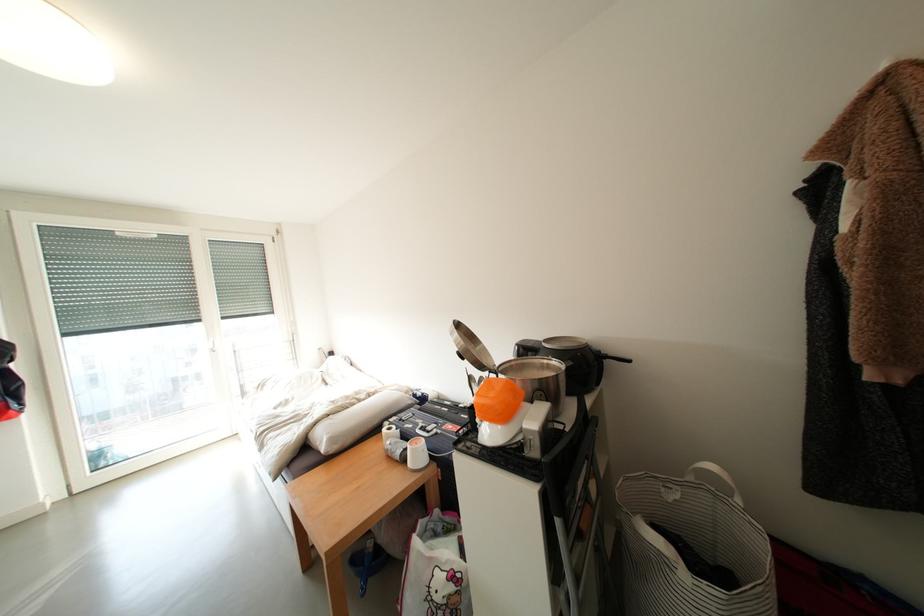
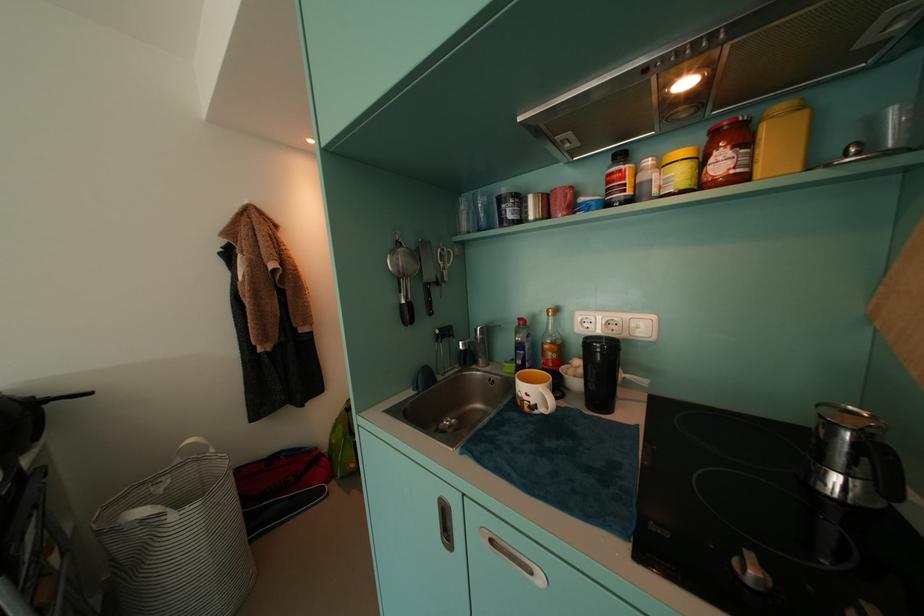
Question: The camera is either moving clockwise (left) or counter-clockwise (right) around the object. The first image is from the beginning of the video and the second image is from the end. Is the camera moving left or right when shooting the video?

Choices:
 (A) Left
 (B) Right

Answer: (A)